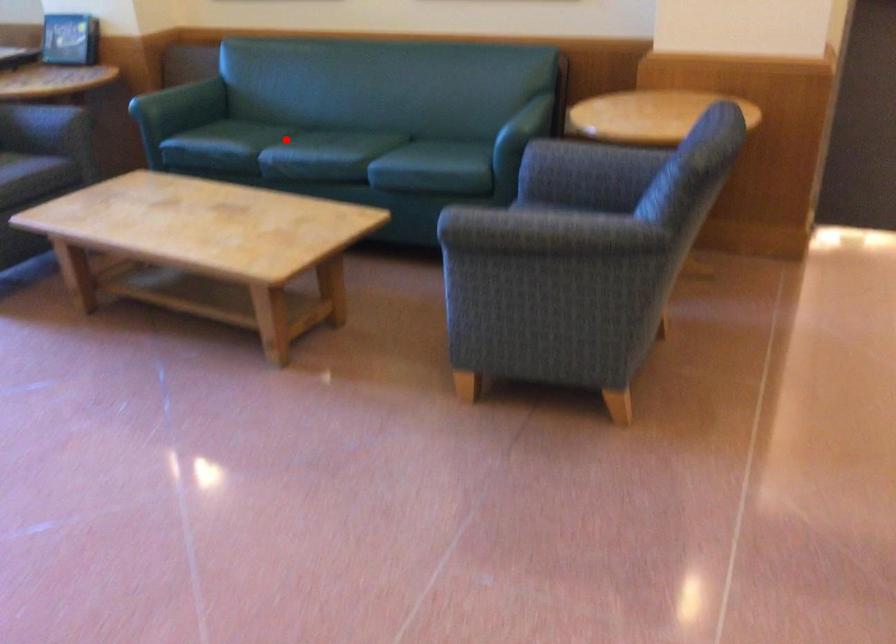
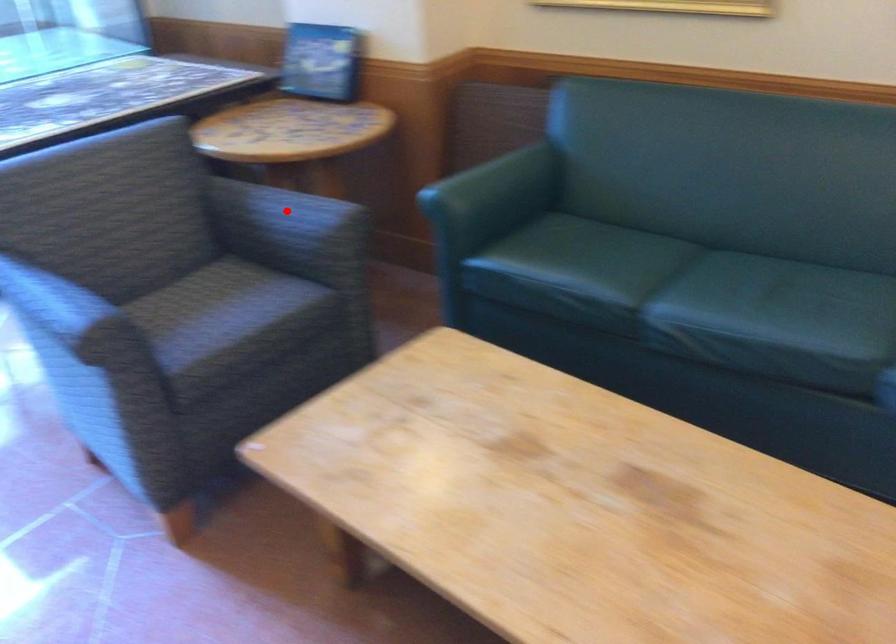
I am providing you with two images of the same scene from different viewpoints. A red point is marked on the first image and another point is marked on the second image. Do the highlighted points in image1 and image2 indicate the same real-world spot?

No